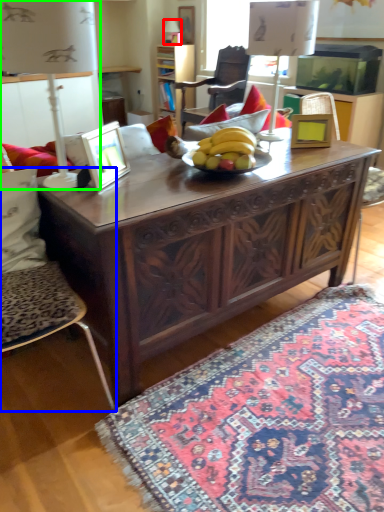
Question: Which is nearer to the lamp (highlighted by a red box)? chair (highlighted by a blue box) or lamp (highlighted by a green box).

Choices:
 (A) chair
 (B) lamp

Answer: (B)